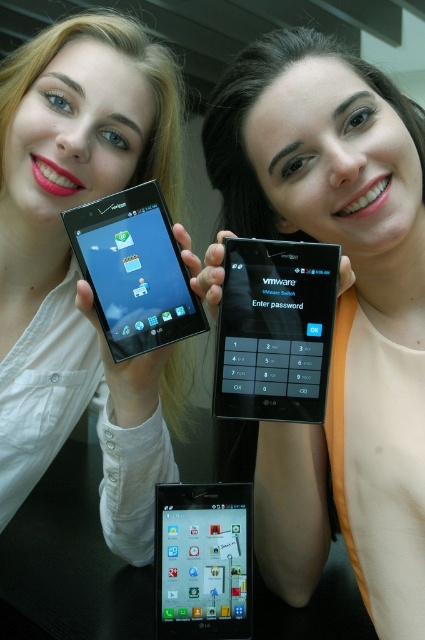
What are the coordinates of the black glossy tablet at center?

The black glossy tablet at center is located at point (274,330).

You are standing in front of the table where two people are holding smartphones. There are two points marked on the table surface. The first point is at coordinates point (112, 218) and the second is at point (178, 600). Which point is closer to you?

Point (112, 218) is in front of point (178, 600), so it is closer to you.

You are trying to decide which device to use for a quick text message. The matte black phone at center and the black glossy tablet at upper left are both available. Considering their sizes, which device might be more convenient for one handed use?

The black glossy tablet at upper left is narrower than the matte black phone at center, so it might be more convenient for one handed use due to its smaller width.